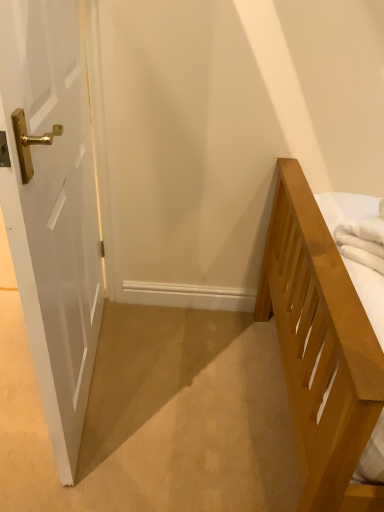
Question: From the image's perspective, is white glossy door at left positioned above or below white soft towel at right?

Choices:
 (A) below
 (B) above

Answer: (B)

Question: From their relative heights in the image, would you say white glossy door at left is taller or shorter than white soft towel at right?

Choices:
 (A) short
 (B) tall

Answer: (B)

Question: Considering the positions of point (74, 120) and point (382, 243), is point (74, 120) closer or farther from the camera than point (382, 243)?

Choices:
 (A) closer
 (B) farther

Answer: (B)

Question: From the image's perspective, is white soft towel at right located above or below white glossy door at left?

Choices:
 (A) below
 (B) above

Answer: (A)

Question: Is white soft towel at right spatially inside white glossy door at left, or outside of it?

Choices:
 (A) outside
 (B) inside

Answer: (A)

Question: Considering the relative positions of white soft towel at right and white glossy door at left in the image provided, is white soft towel at right to the left or to the right of white glossy door at left?

Choices:
 (A) left
 (B) right

Answer: (B)

Question: From a real-world perspective, relative to white glossy door at left, is white soft towel at right vertically above or below?

Choices:
 (A) below
 (B) above

Answer: (B)